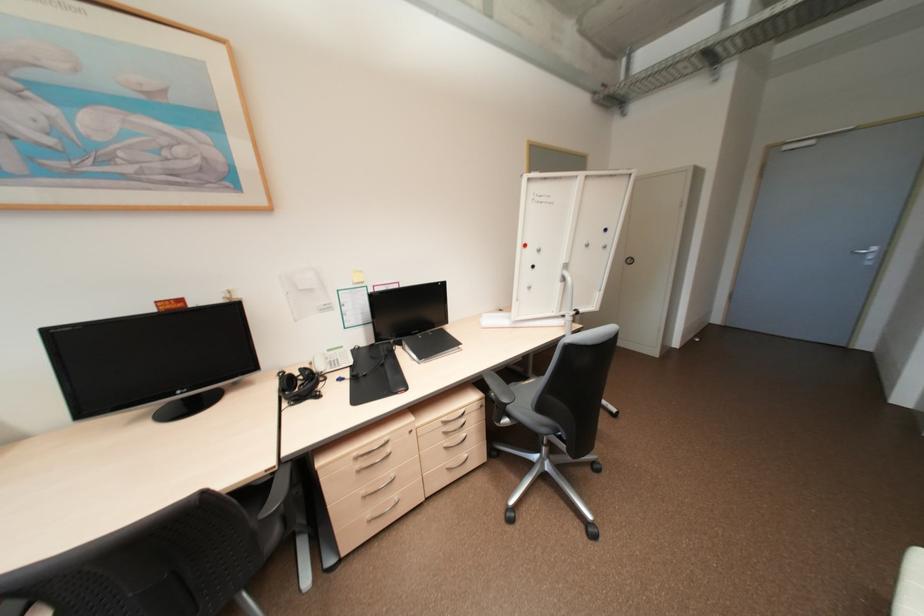
Describe the element at coordinates (383, 509) in the screenshot. I see `the white cabinet handle` at that location.